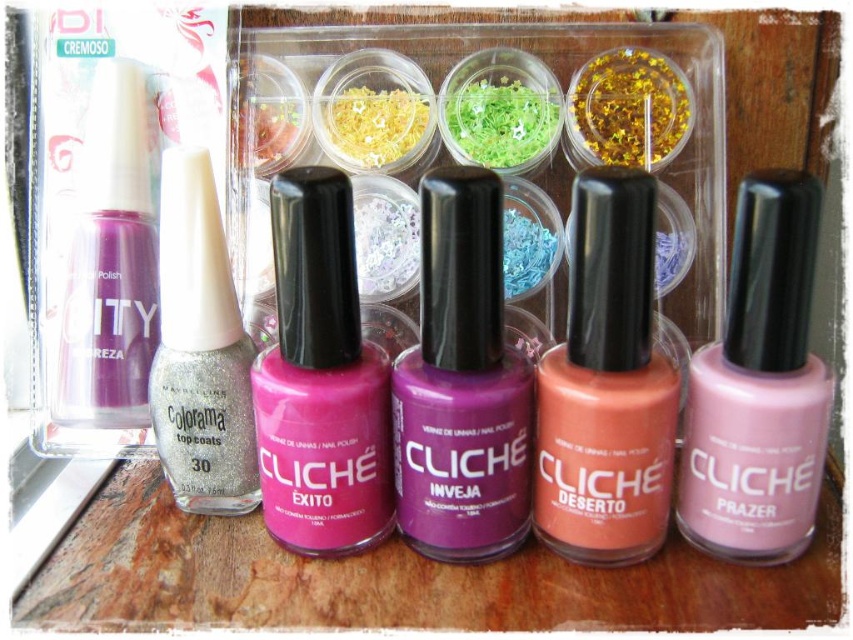
Consider the image. You are organizing a beauty store shelf and need to place two nail polishes. The matte coral nail polish at center and the matte purple nail polish at left are currently on the shelf. A customer wants to know which one is closer to the front of the shelf. Which one is it?

The matte coral nail polish at center is closer to the front of the shelf because it is in front of the matte purple nail polish at left.

You are organizing a beauty supply store and need to stack the purple matte nail polish at center and the glittery silver nail polish at center vertically on a shelf. Given that the shelf has limited vertical space, which nail polish should be placed at the bottom to ensure stability?

The purple matte nail polish at center should be placed at the bottom because it has a greater height than the glittery silver nail polish at center, providing a stable base for the stack.

You are organizing a beauty counter and need to place the purple matte nail polish at center and the glittery silver nail polish at center. According to the arrangement in the image, which one should be placed closer to the customer?

The purple matte nail polish at center should be placed closer to the customer since it is in front of the glittery silver nail polish at center in the image.